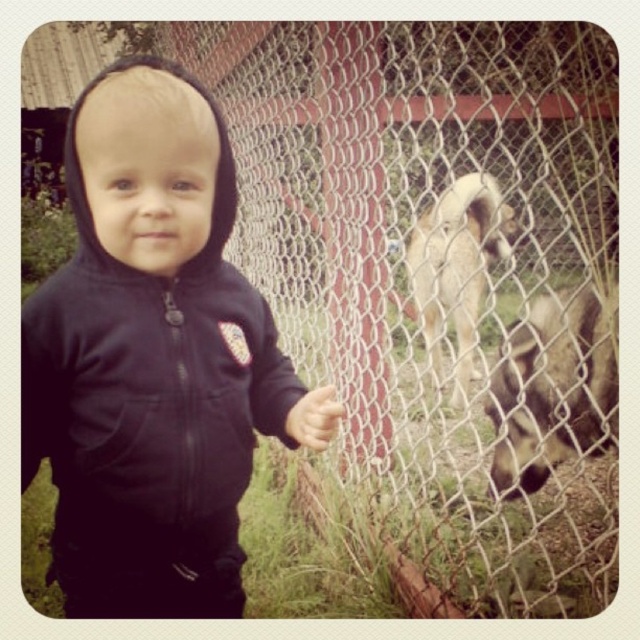
Question: Does black fleece hoodie at center appear on the left side of fuzzy beige dog at center?

Choices:
 (A) yes
 (B) no

Answer: (A)

Question: Can you confirm if black fleece hoodie at center is wider than fuzzy beige dog at center?

Choices:
 (A) no
 (B) yes

Answer: (A)

Question: Among these objects, which one is nearest to the camera?

Choices:
 (A) fuzzy beige dog at center
 (B) fuzzy brown fur at right
 (C) black fleece hoodie at center

Answer: (C)

Question: Is fuzzy brown fur at right further to the viewer compared to fuzzy beige dog at center?

Choices:
 (A) no
 (B) yes

Answer: (A)

Question: Which object appears farthest from the camera in this image?

Choices:
 (A) black fleece hoodie at center
 (B) fuzzy brown fur at right
 (C) fuzzy beige dog at center

Answer: (C)

Question: Which object appears closest to the camera in this image?

Choices:
 (A) fuzzy beige dog at center
 (B) fuzzy brown fur at right

Answer: (B)